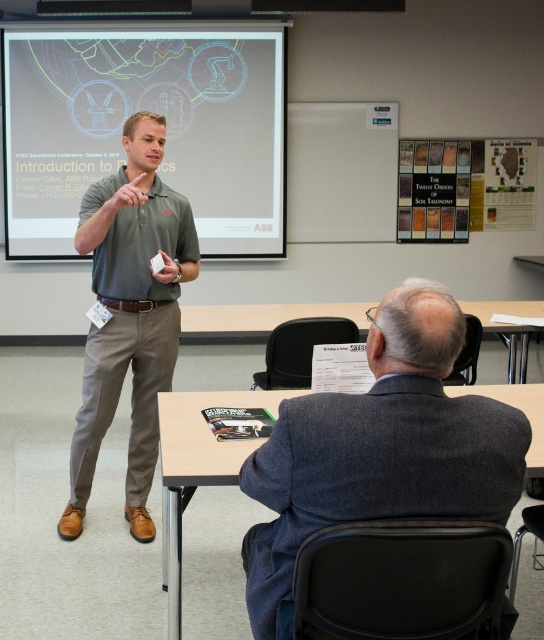
You are sitting in the front row of the classroom and want to see both the matte white projector screen at upper center and the matte gray shirt at center. Which object is closer to you?

The matte white projector screen at upper center is closer to you because it is further to the viewer than the matte gray shirt at center.

You are sitting in the classroom and looking at the projector screen. There are two points marked on the screen at coordinates point (249, 186) and point (77, 451). Which point is closer to the front of the classroom?

Point (77, 451) is closer to the front of the classroom because it is closer to the viewer than point (249, 186).